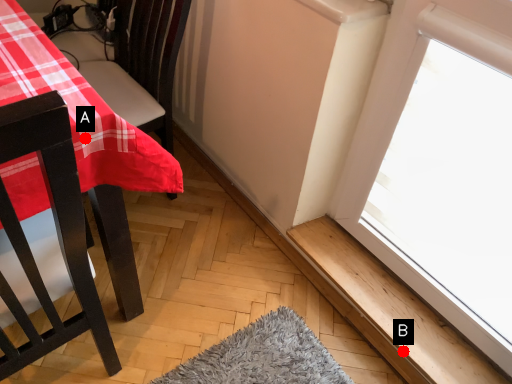
Question: Two points are circled on the image, labeled by A and B beside each circle. Which point is farther from the camera taking this photo?

Choices:
 (A) A is further
 (B) B is further

Answer: (B)